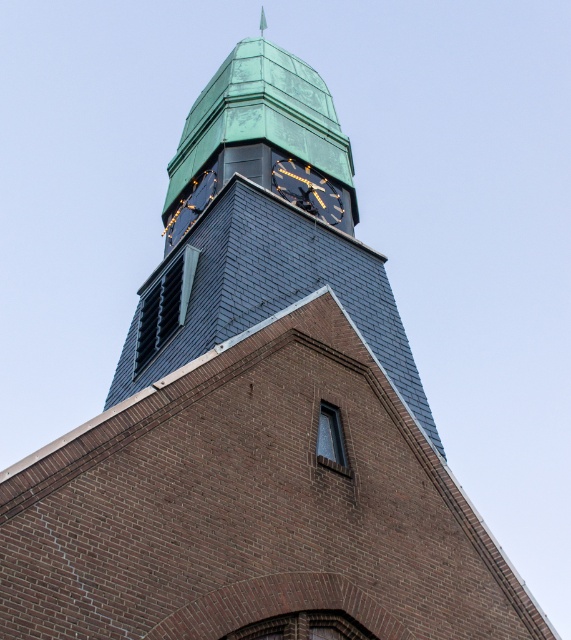
Question: Does black metal clock at upper center appear on the right side of metallic gold clock at upper center?

Choices:
 (A) no
 (B) yes

Answer: (B)

Question: Which object appears farthest from the camera in this image?

Choices:
 (A) green copper clock tower at upper center
 (B) black metal clock at upper center
 (C) metallic gold clock at upper center

Answer: (B)

Question: Which of these objects is positioned closest to the metallic gold clock at upper center?

Choices:
 (A) black metal clock at upper center
 (B) green copper clock tower at upper center

Answer: (A)

Question: Is black metal clock at upper center wider than metallic gold clock at upper center?

Choices:
 (A) no
 (B) yes

Answer: (B)

Question: Which object is the closest to the black metal clock at upper center?

Choices:
 (A) green copper clock tower at upper center
 (B) metallic gold clock at upper center

Answer: (A)

Question: Does green copper clock tower at upper center appear under metallic gold clock at upper center?

Choices:
 (A) no
 (B) yes

Answer: (A)